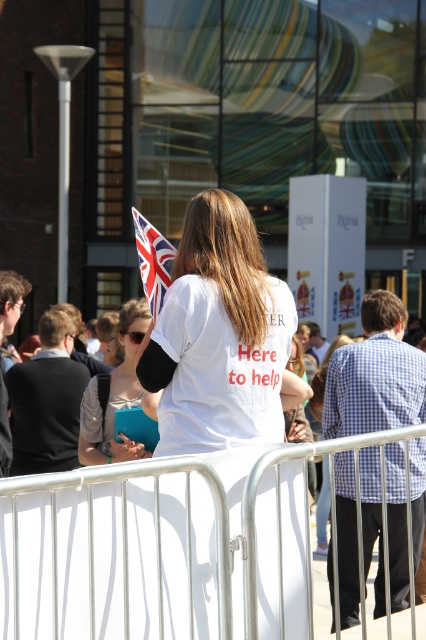
You are planning to hang a large banner that is 2 meters wide between the white metal fence at center and the polyester flag at upper center. Based on the scene description, will the banner fit between them without overlapping either object?

The white metal fence at center is wider than the polyester flag at upper center. However, the exact distance between them isn not specified in the provided information. Therefore, it is uncertain if the banner will fit without overlapping either object.

You are a photographer at the event and want to capture a photo of the polyester flag at upper center without the white metal fence at center blocking it. What should you do?

Move backward to position yourself further away from the white metal fence at center so that it no longer blocks your view of the polyester flag at upper center.